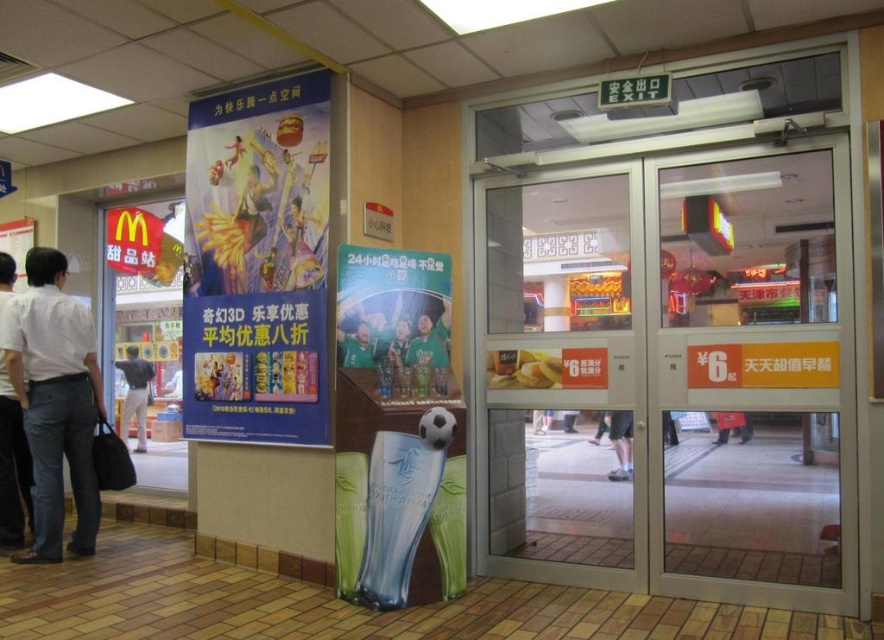
Can you confirm if white shirt at left is positioned to the left of red fabric bag at center?

Indeed, white shirt at left is positioned on the left side of red fabric bag at center.

Between point (19, 497) and point (715, 417), which one is positioned in front?

Positioned in front is point (715, 417).

Is point (2, 436) positioned in front of point (728, 435)?

No, it is not.

Identify the location of white shirt at left. This screenshot has width=884, height=640. (12, 467).

Is dark blue shirt at left positioned before red fabric bag at center?

No, dark blue shirt at left is further to the viewer.

Between dark blue shirt at left and red fabric bag at center, which one appears on the right side from the viewer's perspective?

red fabric bag at center is more to the right.

Is point (139, 442) positioned before point (715, 422)?

That is False.

Identify the location of dark blue shirt at left. The image size is (884, 640). (135, 394).

Measure the distance between point (28, 273) and camera.

Point (28, 273) and camera are 4.36 meters apart.

Is point (66, 330) positioned in front of point (153, 205)?

Yes, it is.

Where is `light gray pants at left`? light gray pants at left is located at coordinates [x=55, y=401].

Find the location of a particular element. light gray pants at left is located at coordinates (55, 401).